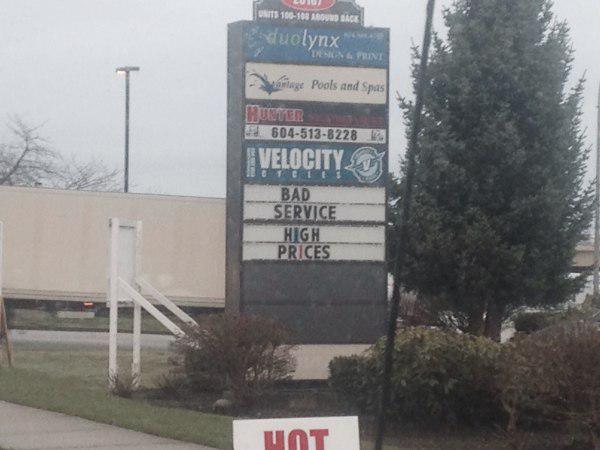
Image resolution: width=600 pixels, height=450 pixels. What are the coordinates of `white light` in the screenshot? It's located at (118, 72).